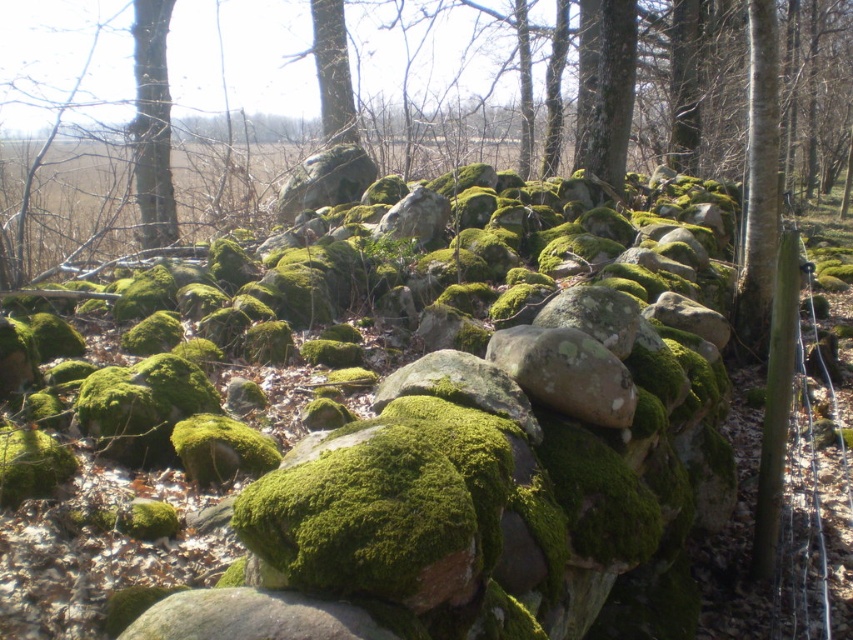
Can you confirm if green mossy rock at center is smaller than smooth bark tree at left?

Indeed, green mossy rock at center has a smaller size compared to smooth bark tree at left.

Is point (531, 349) farther from camera compared to point (154, 74)?

No.

Does point (596, 376) lie in front of point (140, 154)?

Yes.

Where is `green mossy rock at center`? green mossy rock at center is located at coordinates (566, 372).